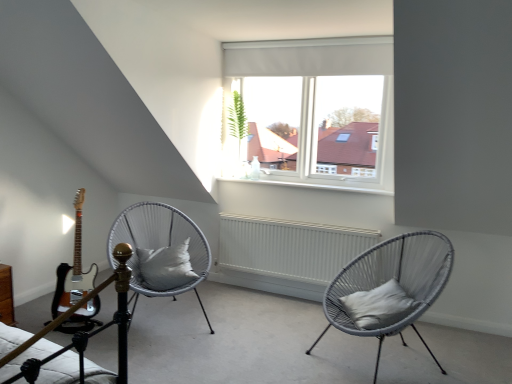
What do you see at coordinates (393, 281) in the screenshot? The width and height of the screenshot is (512, 384). I see `woven grey chair at center, the second chair viewed from the left` at bounding box center [393, 281].

The image size is (512, 384). Describe the element at coordinates (73, 269) in the screenshot. I see `white glossy electric guitar at left` at that location.

Identify the location of white fabric pillow at center, placed as the second pillow when sorted from front to back. This screenshot has width=512, height=384. (166, 267).

The height and width of the screenshot is (384, 512). I want to click on woven grey chair at center, the second chair viewed from the left, so click(393, 281).

Does point (59, 307) come closer to viewer compared to point (183, 276)?

That is False.

Does white glossy electric guitar at left come in front of white fabric pillow at center, placed as the second pillow when sorted from front to back?

Yes, the depth of white glossy electric guitar at left is less than that of white fabric pillow at center, placed as the second pillow when sorted from front to back.

Can you confirm if white glossy electric guitar at left is taller than white fabric pillow at center, which ranks as the first pillow in left-to-right order?

Indeed, white glossy electric guitar at left has a greater height compared to white fabric pillow at center, which ranks as the first pillow in left-to-right order.

Locate an element on the screen. Image resolution: width=512 pixels, height=384 pixels. chair that appears in front of the white woven chair at center, which is the 2th chair from right to left is located at coordinates (393, 281).

Is woven grey chair at center, the second chair viewed from the left, facing away from white woven chair at center, placed as the 1th chair when sorted from left to right?

woven grey chair at center, the second chair viewed from the left, is not turned away from white woven chair at center, placed as the 1th chair when sorted from left to right.

Is woven grey chair at center, the 1th chair viewed from the right, wider than white woven chair at center, which is the 2th chair from right to left?

Yes.

Which object is positioned more to the right, gray fabric pillow at right, arranged as the 2th pillow when viewed from the left, or white matte radiator at center?

gray fabric pillow at right, arranged as the 2th pillow when viewed from the left, is more to the right.

Identify the location of radiator on the left side of gray fabric pillow at right, which is counted as the first pillow, starting from the front. This screenshot has width=512, height=384. (290, 247).

How different are the orientations of gray fabric pillow at right, arranged as the 1th pillow when viewed from the right, and white matte radiator at center in degrees?

The angular difference between gray fabric pillow at right, arranged as the 1th pillow when viewed from the right, and white matte radiator at center is 60.8 degrees.

Is gray fabric pillow at right, which is counted as the first pillow, starting from the front, taller than white matte radiator at center?

No.

Consider the image. From the image's perspective, is woven grey chair at center, the second chair viewed from the left, positioned above or below white glossy electric guitar at left?

From the image's perspective, woven grey chair at center, the second chair viewed from the left, appears below white glossy electric guitar at left.

From a real-world perspective, which is physically below, woven grey chair at center, the 1th chair viewed from the right, or white glossy electric guitar at left?

From a 3D spatial view, woven grey chair at center, the 1th chair viewed from the right, is below.

Between woven grey chair at center, the 1th chair viewed from the right, and white glossy electric guitar at left, which one appears on the right side from the viewer's perspective?

woven grey chair at center, the 1th chair viewed from the right, is more to the right.

Which of these two, woven grey chair at center, the second chair viewed from the left, or white glossy electric guitar at left, is smaller?

Smaller between the two is white glossy electric guitar at left.

Considering the relative sizes of white fabric pillow at center, which ranks as the first pillow in left-to-right order, and white matte radiator at center in the image provided, is white fabric pillow at center, which ranks as the first pillow in left-to-right order, smaller than white matte radiator at center?

Yes.

From a real-world perspective, between white fabric pillow at center, which ranks as the first pillow in left-to-right order, and white matte radiator at center, who is vertically higher?

In real-world perspective, white fabric pillow at center, which ranks as the first pillow in left-to-right order, is above.

Which is behind, point (178, 251) or point (248, 259)?

Positioned behind is point (248, 259).

Between white matte radiator at center and white glossy electric guitar at left, which one appears on the right side from the viewer's perspective?

Positioned to the right is white matte radiator at center.

Relative to white glossy electric guitar at left, is white matte radiator at center in front or behind?

Visually, white matte radiator at center is located behind white glossy electric guitar at left.

Can you see white matte radiator at center touching white glossy electric guitar at left?

white matte radiator at center and white glossy electric guitar at left are not in contact.

Which object is thinner, white fabric pillow at center, the first pillow positioned from the back, or white woven chair at center, which is the 2th chair from right to left?

white fabric pillow at center, the first pillow positioned from the back.

Is the depth of white fabric pillow at center, arranged as the 2th pillow when viewed from the right, greater than that of white woven chair at center, which is the 2th chair from right to left?

Yes.

How many degrees apart are the facing directions of white fabric pillow at center, arranged as the 2th pillow when viewed from the right, and white woven chair at center, which is the 2th chair from right to left?

They differ by 11.2 degrees in their facing directions.

Considering the sizes of white fabric pillow at center, the first pillow positioned from the back, and white woven chair at center, placed as the 1th chair when sorted from left to right, in the image, is white fabric pillow at center, the first pillow positioned from the back, taller or shorter than white woven chair at center, placed as the 1th chair when sorted from left to right,?

Considering their sizes, white fabric pillow at center, the first pillow positioned from the back, has less height than white woven chair at center, placed as the 1th chair when sorted from left to right.

Where is `guitar above the white fabric pillow at center, arranged as the 2th pillow when viewed from the right (from a real-world perspective)`? The height and width of the screenshot is (384, 512). guitar above the white fabric pillow at center, arranged as the 2th pillow when viewed from the right (from a real-world perspective) is located at coordinates (73, 269).

At what (x,y) coordinates should I click in order to perform the action: click on chair in front of the white woven chair at center, which is the 2th chair from right to left. Please return your answer as a coordinate pair (x, y). The width and height of the screenshot is (512, 384). Looking at the image, I should click on (393, 281).

Estimate the real-world distances between objects in this image. Which object is further from white matte radiator at center, white fabric pillow at center, placed as the second pillow when sorted from front to back, or white woven chair at center, which is the 2th chair from right to left?

The object further to white matte radiator at center is white fabric pillow at center, placed as the second pillow when sorted from front to back.

Considering their positions, is white matte radiator at center positioned closer to woven grey chair at center, the 1th chair viewed from the right, than white woven chair at center, which is the 2th chair from right to left?

Among the two, white matte radiator at center is located nearer to woven grey chair at center, the 1th chair viewed from the right.

Based on their spatial positions, is woven grey chair at center, the second chair viewed from the left, or white woven chair at center, which is the 2th chair from right to left, closer to white fabric pillow at center, placed as the second pillow when sorted from front to back?

Among the two, white woven chair at center, which is the 2th chair from right to left, is located nearer to white fabric pillow at center, placed as the second pillow when sorted from front to back.

Estimate the real-world distances between objects in this image. Which object is further from white woven chair at center, placed as the 1th chair when sorted from left to right, white fabric pillow at center, placed as the second pillow when sorted from front to back, or white glossy electric guitar at left?

white glossy electric guitar at left.

Which object lies nearer to the anchor point white glossy electric guitar at left, white woven chair at center, which is the 2th chair from right to left, or gray fabric pillow at right, arranged as the 2th pillow when viewed from the left?

white woven chair at center, which is the 2th chair from right to left.

When comparing their distances from white glossy electric guitar at left, does white fabric pillow at center, the first pillow positioned from the back, or white matte radiator at center seem closer?

white fabric pillow at center, the first pillow positioned from the back.

Estimate the real-world distances between objects in this image. Which object is closer to gray fabric pillow at right, placed as the 2th pillow when sorted from back to front, white woven chair at center, which is the 2th chair from right to left, or white glossy electric guitar at left?

white woven chair at center, which is the 2th chair from right to left.

From the picture: From the image, which object appears to be farther from white fabric pillow at center, which ranks as the first pillow in left-to-right order, white matte radiator at center or white woven chair at center, which is the 2th chair from right to left?

Based on the image, white matte radiator at center appears to be further to white fabric pillow at center, which ranks as the first pillow in left-to-right order.

Where is `radiator situated between white glossy electric guitar at left and gray fabric pillow at right, placed as the 2th pillow when sorted from back to front, from left to right`? This screenshot has height=384, width=512. radiator situated between white glossy electric guitar at left and gray fabric pillow at right, placed as the 2th pillow when sorted from back to front, from left to right is located at coordinates (290, 247).

Find the location of `pillow located between white glossy electric guitar at left and gray fabric pillow at right, arranged as the 1th pillow when viewed from the right, in the left-right direction`. pillow located between white glossy electric guitar at left and gray fabric pillow at right, arranged as the 1th pillow when viewed from the right, in the left-right direction is located at coordinates (166, 267).

Find the location of a particular element. The image size is (512, 384). chair situated between white glossy electric guitar at left and white fabric pillow at center, arranged as the 2th pillow when viewed from the right, from left to right is located at coordinates (159, 245).

Locate an element on the screen. The height and width of the screenshot is (384, 512). chair located between white glossy electric guitar at left and white matte radiator at center in the left-right direction is located at coordinates (159, 245).